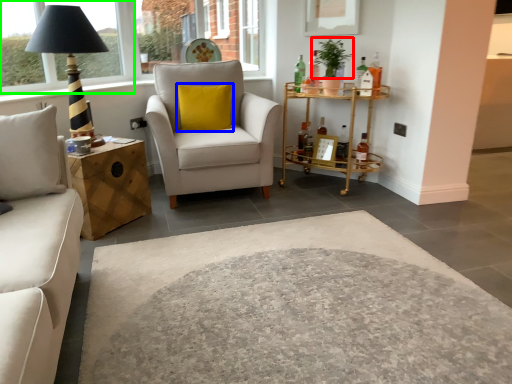
Question: Which object is the closest to the plant (highlighted by a red box)? Choose among these: pillow (highlighted by a blue box) or window frame (highlighted by a green box).

Choices:
 (A) pillow
 (B) window frame

Answer: (A)